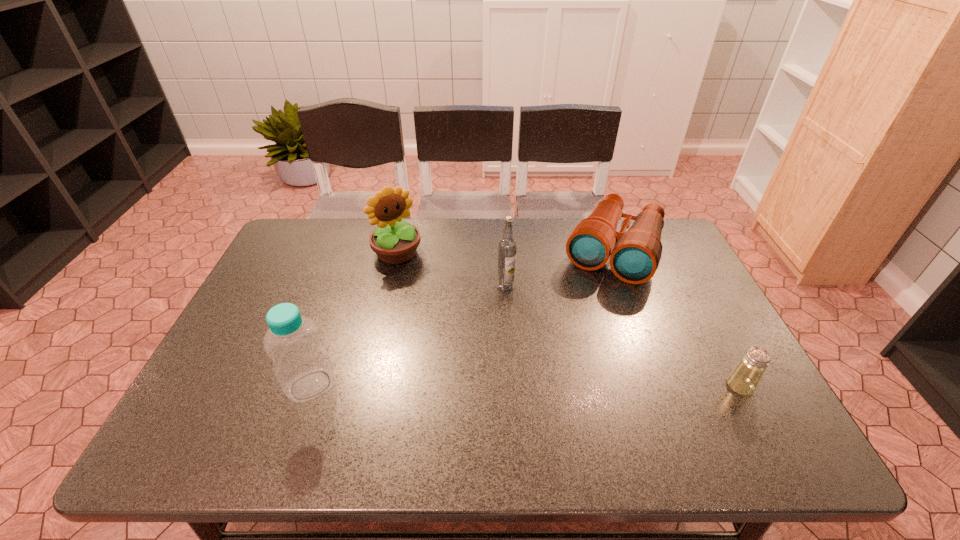
Locate an element on the screen. The height and width of the screenshot is (540, 960). saltshaker that is at the right edge is located at coordinates (744, 379).

Where is `binoculars at the right edge`? binoculars at the right edge is located at coordinates (635, 254).

You are a GUI agent. You are given a task and a screenshot of the screen. Output one action in this format:
    pyautogui.click(x=<x>, y=<y>)
    Task: Click on the object present at the far right corner
    
    Given the screenshot: What is the action you would take?
    pyautogui.click(x=635, y=254)

You are a GUI agent. You are given a task and a screenshot of the screen. Output one action in this format:
    pyautogui.click(x=<x>, y=<y>)
    Task: Click on the object positioned at the near right corner
    Image resolution: width=960 pixels, height=540 pixels.
    Given the screenshot: What is the action you would take?
    pyautogui.click(x=744, y=379)

What are the coordinates of `free spot at the far edge of the desktop` in the screenshot? It's located at (437, 250).

The height and width of the screenshot is (540, 960). Identify the location of free space at the near edge. coord(560,417).

In the image, there is a desktop. Identify the location of vacant space at the left edge. click(283, 275).

Where is `free space at the right edge`? The width and height of the screenshot is (960, 540). free space at the right edge is located at coordinates (687, 351).

Locate an element on the screen. The width and height of the screenshot is (960, 540). free spot at the far left corner of the desktop is located at coordinates (313, 245).

Find the location of a particular element. Image resolution: width=960 pixels, height=540 pixels. blank area at the far right corner is located at coordinates (666, 260).